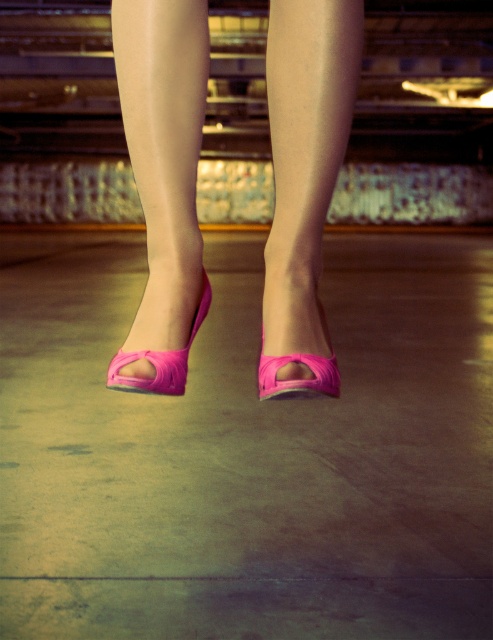
Question: Observing the image, what is the correct spatial positioning of neon pink satin heels at center in reference to matte pink high-heeled shoe at center?

Choices:
 (A) above
 (B) below

Answer: (A)

Question: Estimate the real-world distances between objects in this image. Which object is farther from the pink matte toe at center?

Choices:
 (A) neon pink satin high-heeled shoe at center
 (B) neon pink satin heels at center
 (C) neon pink satin sandal at lower center

Answer: (B)

Question: Does neon pink fabric heels at center have a greater width compared to neon pink satin sandal at lower center?

Choices:
 (A) yes
 (B) no

Answer: (A)

Question: Is neon pink fabric heels at center smaller than matte pink high-heeled shoe at center?

Choices:
 (A) no
 (B) yes

Answer: (A)

Question: Which object is positioned closest to the pink matte toe at center?

Choices:
 (A) neon pink satin high-heeled shoe at center
 (B) neon pink fabric heels at center

Answer: (A)

Question: Which of the following is the closest to the observer?

Choices:
 (A) neon pink fabric heels at center
 (B) pink matte toe at center
 (C) neon pink satin high-heeled shoe at center

Answer: (C)